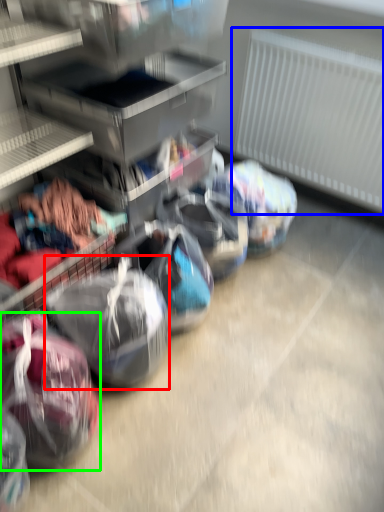
Question: Which is farther away from sack (highlighted by a red box)? radiator (highlighted by a blue box) or sack (highlighted by a green box)?

Choices:
 (A) radiator
 (B) sack

Answer: (A)